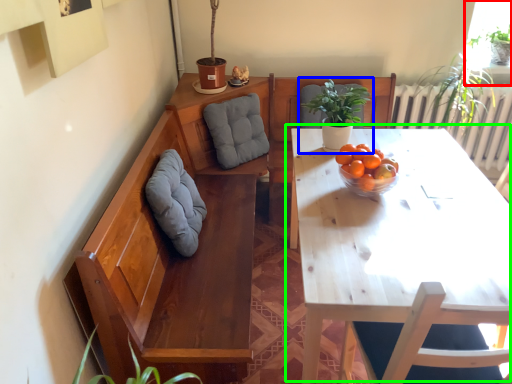
Question: Which object is positioned closest to window (highlighted by a red box)? Select from houseplant (highlighted by a blue box) and table (highlighted by a green box).

Choices:
 (A) houseplant
 (B) table

Answer: (A)